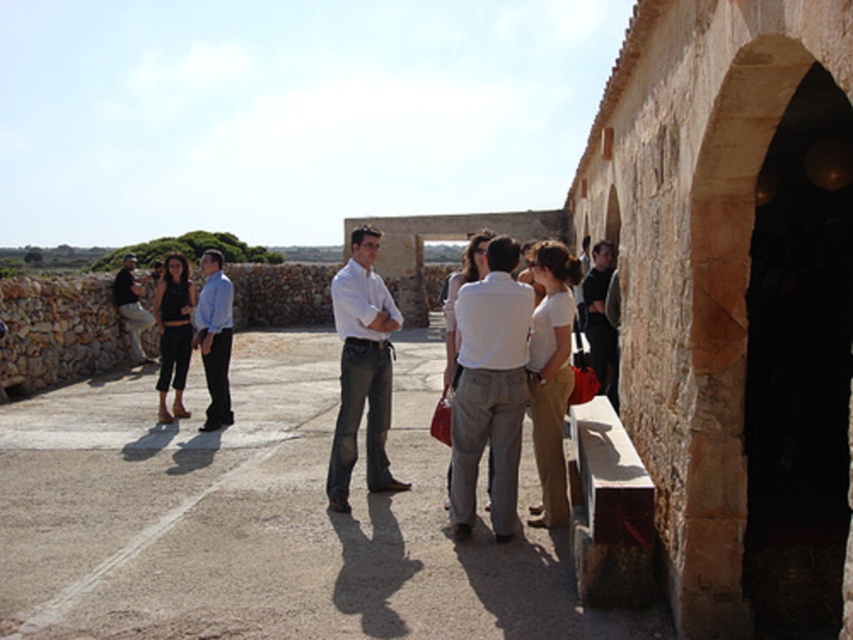
In the scene shown: You are a photographer standing in front of the stone archway. You want to take a photo that includes both the matte blue shirt at center and the matte black shirt at right. Which person should you focus on first to ensure both are in frame?

You should focus on the matte blue shirt at center first because it is closer to you than the matte black shirt at right, ensuring both are in frame.

You are part of a tour group standing near a stone archway. You notice two people in the group wearing matte white shirt at center and matte black shirt at left. From your perspective, which shirt is positioned to the right?

The matte white shirt at center is positioned to the right of the matte black shirt at left.

From the picture: You are standing in front of the stone structure with arches and want to take a photo of both the point at coordinates (350, 451) and the point at (135, 280). Which point will appear larger in your camera view?

Point (350, 451) is closer to the viewer than point (135, 280), so it will appear larger in the camera view.